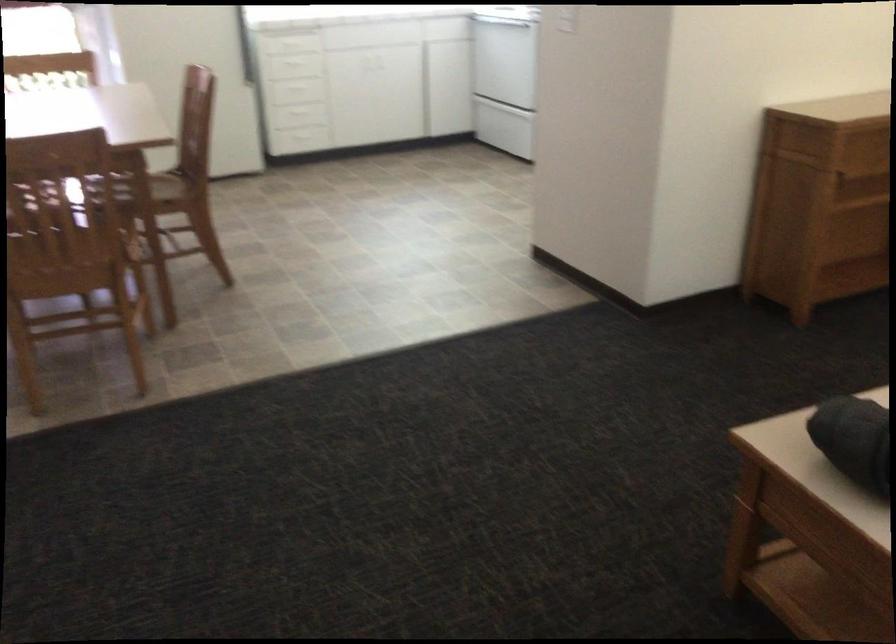
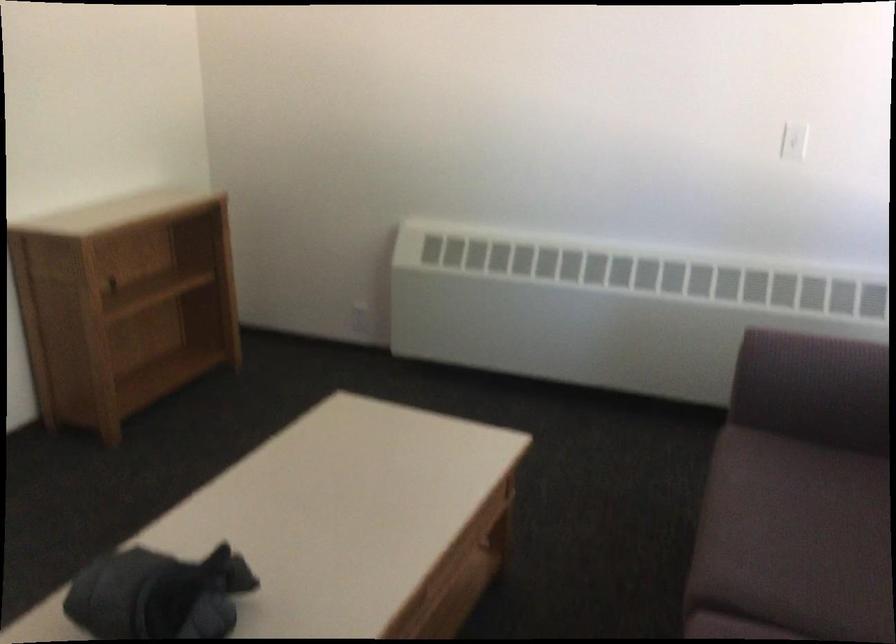
Question: The camera is either moving clockwise (left) or counter-clockwise (right) around the object. The first image is from the beginning of the video and the second image is from the end. Is the camera moving left or right when shooting the video?

Choices:
 (A) Left
 (B) Right

Answer: (A)